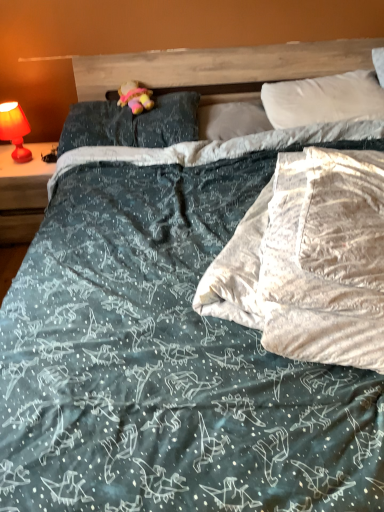
Question: Considering the relative sizes of white soft pillow at upper right, marked as the 3th pillow in a left-to-right arrangement, and dark blue fabric pillow at upper center, which ranks as the third pillow in right-to-left order, in the image provided, is white soft pillow at upper right, marked as the 3th pillow in a left-to-right arrangement, taller than dark blue fabric pillow at upper center, which ranks as the third pillow in right-to-left order,?

Choices:
 (A) yes
 (B) no

Answer: (A)

Question: Is white soft pillow at upper right, which is the 1th pillow in right-to-left order, to the left of dark blue fabric pillow at upper center, arranged as the first pillow when viewed from the left, from the viewer's perspective?

Choices:
 (A) yes
 (B) no

Answer: (B)

Question: Can you confirm if white soft pillow at upper right, which is the 1th pillow in right-to-left order, is bigger than dark blue fabric pillow at upper center, arranged as the first pillow when viewed from the left?

Choices:
 (A) no
 (B) yes

Answer: (B)

Question: Does white soft pillow at upper right, marked as the 3th pillow in a left-to-right arrangement, turn towards dark blue fabric pillow at upper center, which ranks as the third pillow in right-to-left order?

Choices:
 (A) yes
 (B) no

Answer: (B)

Question: From the image's perspective, does white soft pillow at upper right, which is the 1th pillow in right-to-left order, appear higher than dark blue fabric pillow at upper center, which ranks as the third pillow in right-to-left order?

Choices:
 (A) yes
 (B) no

Answer: (A)

Question: Is white soft pillow at upper right, marked as the 3th pillow in a left-to-right arrangement, not within dark blue fabric pillow at upper center, arranged as the first pillow when viewed from the left?

Choices:
 (A) no
 (B) yes

Answer: (B)

Question: Can you confirm if matte red lamp at left is positioned to the right of white soft pillow at center, which is the 2th pillow from right to left?

Choices:
 (A) yes
 (B) no

Answer: (B)

Question: Does matte red lamp at left have a greater height compared to white soft pillow at center, marked as the second pillow in a left-to-right arrangement?

Choices:
 (A) no
 (B) yes

Answer: (B)

Question: From a real-world perspective, is matte red lamp at left on top of white soft pillow at center, which is the 2th pillow from right to left?

Choices:
 (A) yes
 (B) no

Answer: (B)

Question: Does matte red lamp at left have a larger size compared to white soft pillow at center, which is the 2th pillow from right to left?

Choices:
 (A) no
 (B) yes

Answer: (B)

Question: Is matte red lamp at left outside of white soft pillow at center, marked as the second pillow in a left-to-right arrangement?

Choices:
 (A) yes
 (B) no

Answer: (A)

Question: Can you confirm if matte red lamp at left is positioned to the left of white soft pillow at center, which is the 2th pillow from right to left?

Choices:
 (A) yes
 (B) no

Answer: (A)